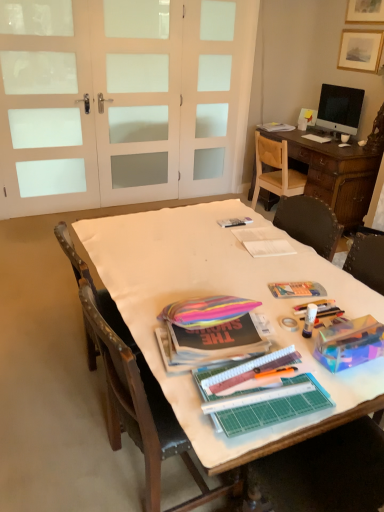
Question: From a real-world perspective, is white paper at center above or below white fabric-covered table at center?

Choices:
 (A) above
 (B) below

Answer: (A)

Question: Considering the positions of white paper at center and white fabric-covered table at center in the image, is white paper at center bigger or smaller than white fabric-covered table at center?

Choices:
 (A) big
 (B) small

Answer: (B)

Question: Which object is positioned closest to the rainbow fabric bag at center, arranged as the 1th magazine when viewed from the left?

Choices:
 (A) matte black magazine at upper center, the 1th magazine from the back
 (B) white frosted glass doors at upper left, acting as the first screen door starting from the left
 (C) white frosted glass screen door at upper center, which is the third screen door from left to right
 (D) white fabric-covered table at center
 (E) wooden chair at center, the 1th chair from the front

Answer: (D)

Question: Estimate the real-world distances between objects in this image. Which object is farther from the wooden picture frame at upper right?

Choices:
 (A) wooden chair at center, the 1th chair from the front
 (B) white frosted glass doors at upper left, placed as the second screen door when sorted from left to right
 (C) matte paper magazine at center, the second magazine positioned from the bottom
 (D) matte black magazine at upper center, positioned as the 1th magazine in right-to-left order
 (E) wooden chair at right, which is counted as the 1th chair, starting from the top

Answer: (A)